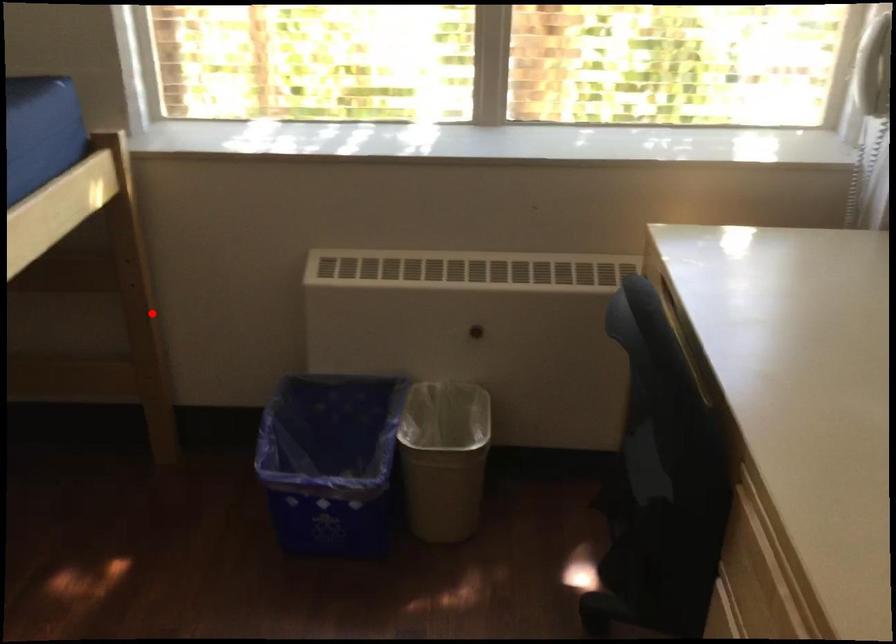
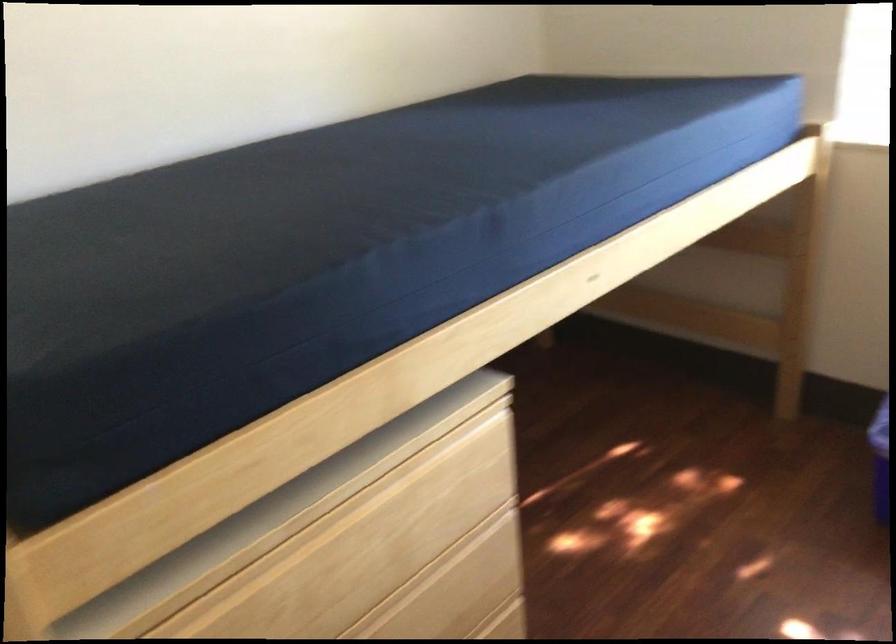
Question: I am providing you with two images of the same scene from different viewpoints. In image1, a red point is highlighted. Considering the same 3D point in image2, which of the following is correct?

Choices:
 (A) It is closer
 (B) It is farther

Answer: (B)